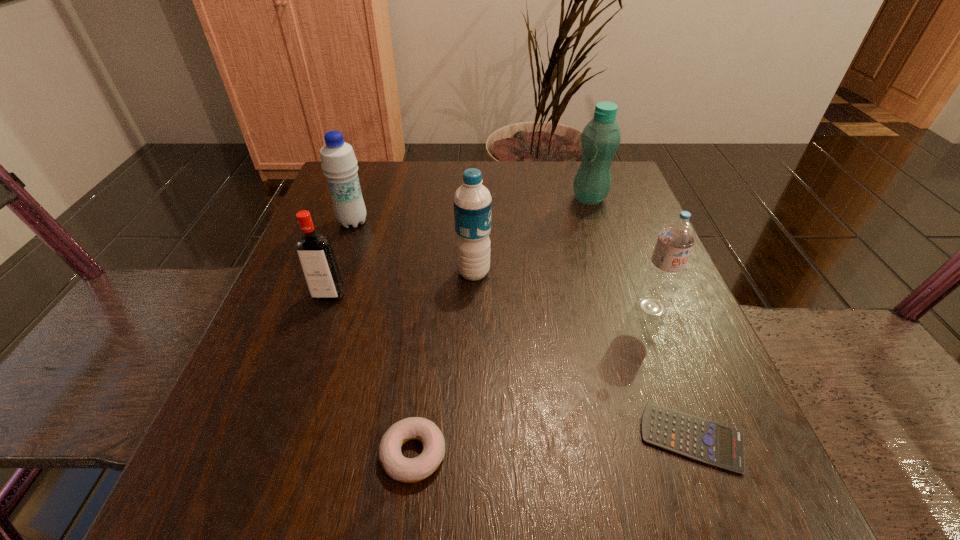
Where is `free spot that satisfies the following two spatial constraints: 1. on the front and back of the doughnut; 2. on the left side of the vodka`? The height and width of the screenshot is (540, 960). free spot that satisfies the following two spatial constraints: 1. on the front and back of the doughnut; 2. on the left side of the vodka is located at coordinates pos(273,454).

Find the location of a particular element. vacant region that satisfies the following two spatial constraints: 1. on the front and back of the vodka; 2. on the right side of the nearest water bottle is located at coordinates (324, 307).

Locate an element on the screen. Image resolution: width=960 pixels, height=540 pixels. free space that satisfies the following two spatial constraints: 1. on the label of the second nearest water bottle; 2. on the front and back of the vodka is located at coordinates (473, 295).